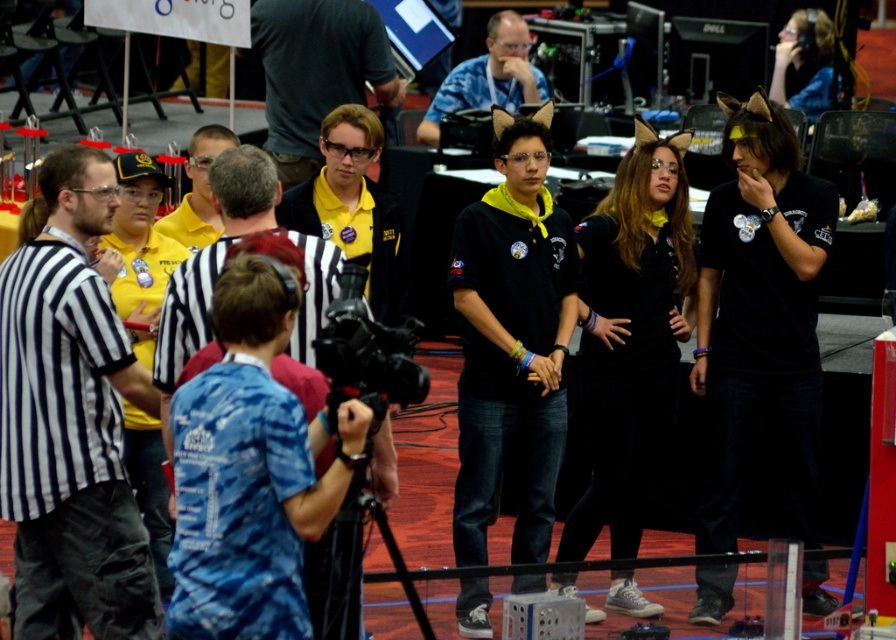
Is matte black jacket at center behind blue fabric shirt at center?

No, it is not.

Is matte black jacket at center bigger than blue fabric shirt at center?

Actually, matte black jacket at center might be smaller than blue fabric shirt at center.

Identify the location of matte black jacket at center. The height and width of the screenshot is (640, 896). (352, 208).

Is matte black jacket at center bigger than black plastic video camera at center?

Yes, matte black jacket at center is bigger than black plastic video camera at center.

Does point (359, 216) come behind point (346, 337)?

Yes, it is.

What do you see at coordinates (352, 208) in the screenshot? This screenshot has height=640, width=896. I see `matte black jacket at center` at bounding box center [352, 208].

Identify the location of matte black jacket at center. The height and width of the screenshot is (640, 896). (352, 208).

Who is higher up, black striped shirt at left or blue fabric shirt at center?

blue fabric shirt at center is higher up.

Is black striped shirt at left bigger than blue fabric shirt at center?

Incorrect, black striped shirt at left is not larger than blue fabric shirt at center.

At what (x,y) coordinates should I click in order to perform the action: click on black striped shirt at left. Please return your answer as a coordinate pair (x, y). The width and height of the screenshot is (896, 640). Looking at the image, I should click on (71, 420).